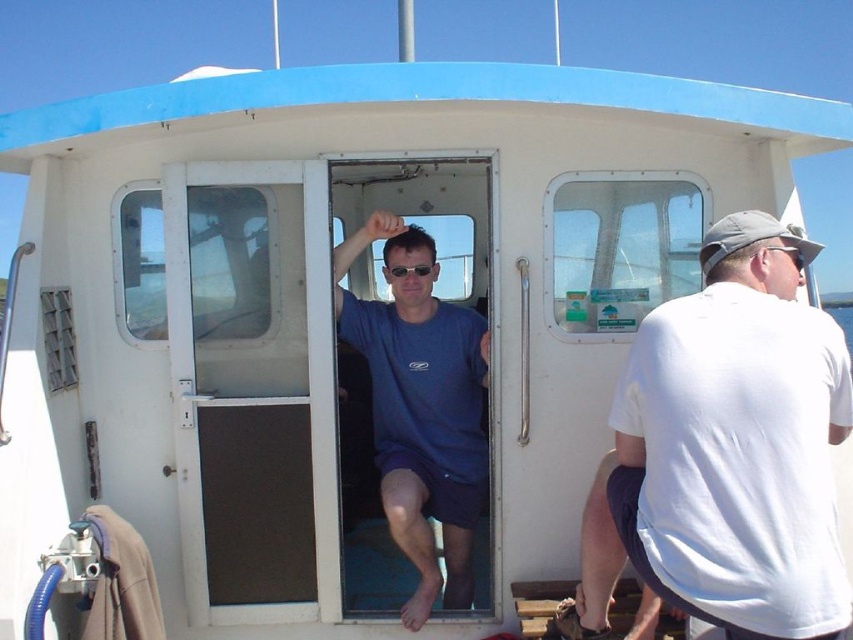
Question: Which point is farther to the camera?

Choices:
 (A) white matte shirt at right
 (B) sunglasses at center
 (C) clear plastic goggles at upper right
 (D) blue matte shirt at center

Answer: (B)

Question: Does white matte shirt at right appear on the right side of clear plastic goggles at upper right?

Choices:
 (A) yes
 (B) no

Answer: (B)

Question: Which object is farther from the camera taking this photo?

Choices:
 (A) white matte shirt at right
 (B) blue matte shirt at center

Answer: (B)

Question: Which object appears farthest from the camera in this image?

Choices:
 (A) blue matte shirt at center
 (B) white matte shirt at right

Answer: (A)

Question: Considering the relative positions of blue matte shirt at center and sunglasses at center in the image provided, where is blue matte shirt at center located with respect to sunglasses at center?

Choices:
 (A) right
 (B) left

Answer: (A)

Question: Does white matte shirt at right have a smaller size compared to blue matte shirt at center?

Choices:
 (A) yes
 (B) no

Answer: (A)